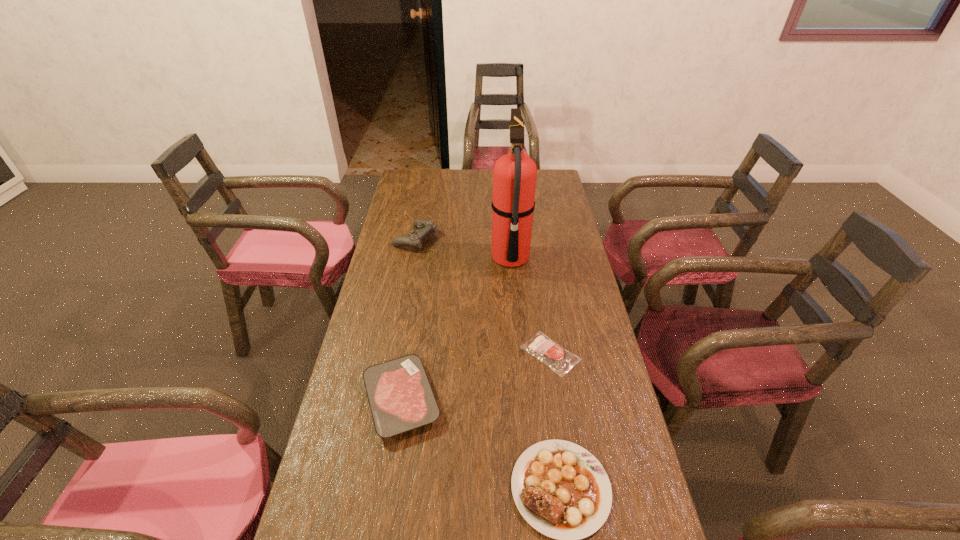
Locate an element on the screen. This screenshot has width=960, height=540. empty space that is in between the control and the fourth tallest object is located at coordinates (409, 319).

The width and height of the screenshot is (960, 540). In order to click on vacant space that's between the shortest steak and the fourth shortest object in this screenshot , I will do `click(483, 296)`.

Image resolution: width=960 pixels, height=540 pixels. Find the location of `free space that is in between the second tallest steak and the tallest object`. free space that is in between the second tallest steak and the tallest object is located at coordinates (456, 329).

This screenshot has height=540, width=960. What are the coordinates of `free area in between the second shortest steak and the second tallest object` in the screenshot? It's located at (409, 319).

You are a GUI agent. You are given a task and a screenshot of the screen. Output one action in this format:
    pyautogui.click(x=<x>, y=<y>)
    Task: Click on the object that is the fourth closest to the third shortest object
    This screenshot has height=540, width=960.
    Given the screenshot: What is the action you would take?
    pyautogui.click(x=425, y=227)

Locate which object ranks fourth in proximity to the leftmost steak. Please provide its 2D coordinates. Your answer should be formatted as a tuple, i.e. [(x, y)], where the tuple contains the x and y coordinates of a point satisfying the conditions above.

[(425, 227)]

Locate an element on the screen. The height and width of the screenshot is (540, 960). the second closest steak to the third tallest object is located at coordinates click(557, 358).

Identify the location of the second closest steak to the control. Image resolution: width=960 pixels, height=540 pixels. (400, 396).

In order to click on free spot that satisfies the following two spatial constraints: 1. on the back side of the shortest steak; 2. on the left side of the second tallest steak in this screenshot , I will do `click(408, 354)`.

Locate an element on the screen. free location that satisfies the following two spatial constraints: 1. at the nozzle of the shortest object; 2. on the left side of the tallest object is located at coordinates (518, 354).